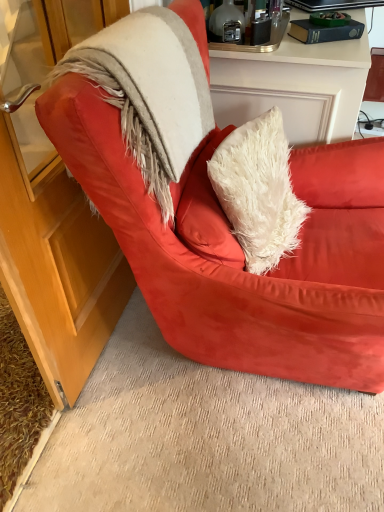
Question: Should I look upward or downward to see black glossy laptop at upper right?

Choices:
 (A) up
 (B) down

Answer: (A)

Question: Can you confirm if suede red armchair at center is bigger than black glossy laptop at upper right?

Choices:
 (A) yes
 (B) no

Answer: (A)

Question: Is suede red armchair at center in front of black glossy laptop at upper right?

Choices:
 (A) no
 (B) yes

Answer: (B)

Question: Is suede red armchair at center looking in the opposite direction of black glossy laptop at upper right?

Choices:
 (A) yes
 (B) no

Answer: (B)

Question: Does suede red armchair at center have a lesser width compared to black glossy laptop at upper right?

Choices:
 (A) yes
 (B) no

Answer: (B)

Question: Would you consider suede red armchair at center to be distant from black glossy laptop at upper right?

Choices:
 (A) yes
 (B) no

Answer: (A)

Question: Is suede red armchair at center outside of black glossy laptop at upper right?

Choices:
 (A) yes
 (B) no

Answer: (A)

Question: Is black glossy laptop at upper right looking in the opposite direction of suede red armchair at center?

Choices:
 (A) no
 (B) yes

Answer: (A)

Question: From the image's perspective, is black glossy laptop at upper right below suede red armchair at center?

Choices:
 (A) yes
 (B) no

Answer: (B)

Question: From a real-world perspective, is black glossy laptop at upper right on suede red armchair at center?

Choices:
 (A) yes
 (B) no

Answer: (A)

Question: Is suede red armchair at center located within black glossy laptop at upper right?

Choices:
 (A) no
 (B) yes

Answer: (A)

Question: Considering the relative positions of black glossy laptop at upper right and suede red armchair at center in the image provided, is black glossy laptop at upper right to the right of suede red armchair at center from the viewer's perspective?

Choices:
 (A) no
 (B) yes

Answer: (B)

Question: Can you confirm if black glossy laptop at upper right is shorter than suede red armchair at center?

Choices:
 (A) no
 (B) yes

Answer: (B)

Question: From the image's perspective, is fuzzy beige fur coat at upper left under black glossy laptop at upper right?

Choices:
 (A) no
 (B) yes

Answer: (B)